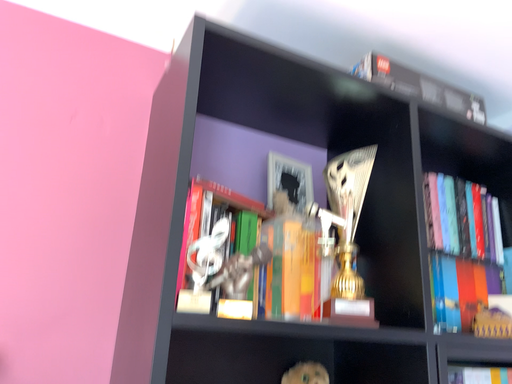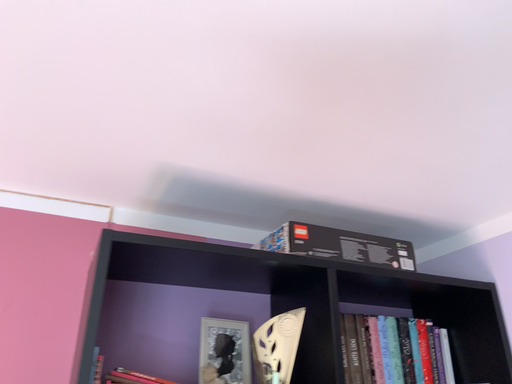
Question: Which way did the camera rotate in the video?

Choices:
 (A) rotated downward
 (B) rotated upward

Answer: (B)